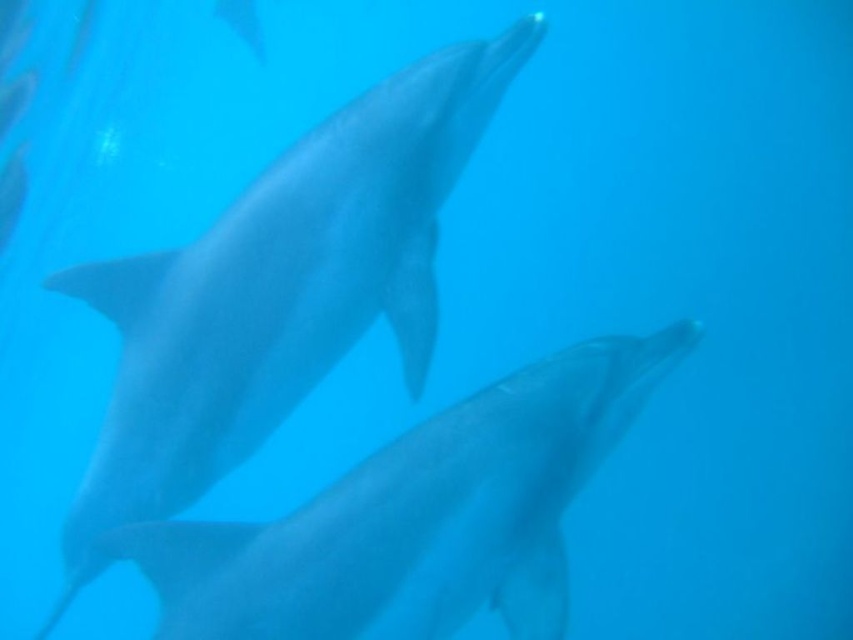
You are an underwater photographer aiming to capture a photo of both dolphins. You are positioned at the surface of the water. Which dolphin, the one at point (433, 202) or the one at point (556, 400), will appear closer to you in the photo?

Point (556, 400) is closer to the photographer than point (433, 202), so the dolphin at point (556, 400) will appear closer in the photo.